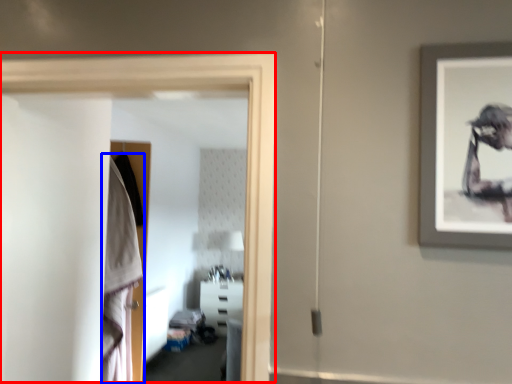
Question: Which point is closer to the camera, glass door (highlighted by a red box) or robe (highlighted by a blue box)?

Choices:
 (A) glass door
 (B) robe

Answer: (A)